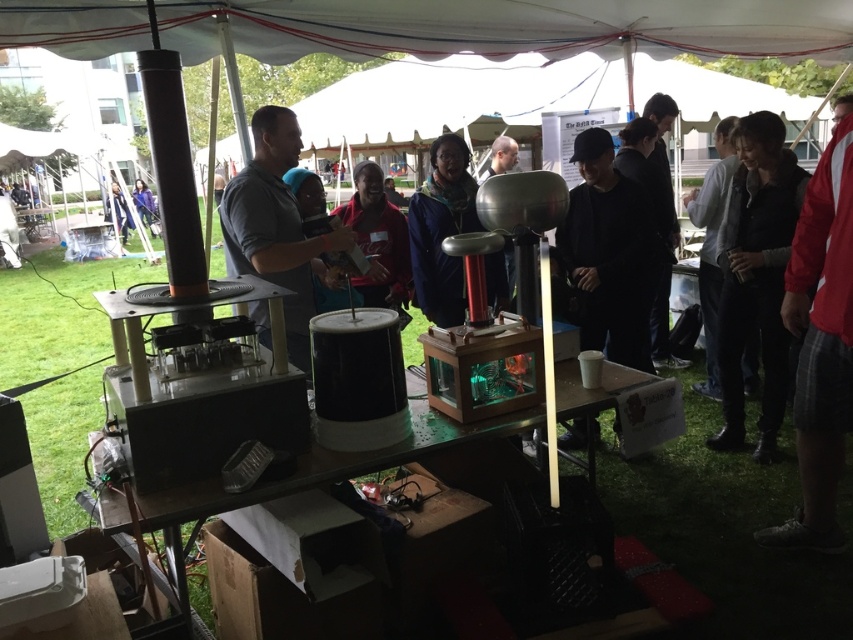
Question: Which object appears closest to the camera in this image?

Choices:
 (A) blue fabric jacket at center
 (B) red plaid shorts at right
 (C) translucent plastic table at center
 (D) matte black shirt at center

Answer: (C)

Question: Does red plaid shorts at right appear on the right side of light gray sweater at center?

Choices:
 (A) no
 (B) yes

Answer: (A)

Question: Considering the real-world distances, which object is farthest from the black matte jacket at center?

Choices:
 (A) light gray sweater at center
 (B) gray matte shirt at center

Answer: (B)

Question: Does translucent plastic table at center appear on the right side of blue fabric jacket at upper left?

Choices:
 (A) no
 (B) yes

Answer: (B)

Question: Is red plaid shorts at right wider than blue fabric jacket at upper left?

Choices:
 (A) yes
 (B) no

Answer: (B)

Question: Which point is closer to the camera?

Choices:
 (A) (610, 332)
 (B) (140, 202)
 (C) (828, 147)
 (D) (112, 182)

Answer: (C)